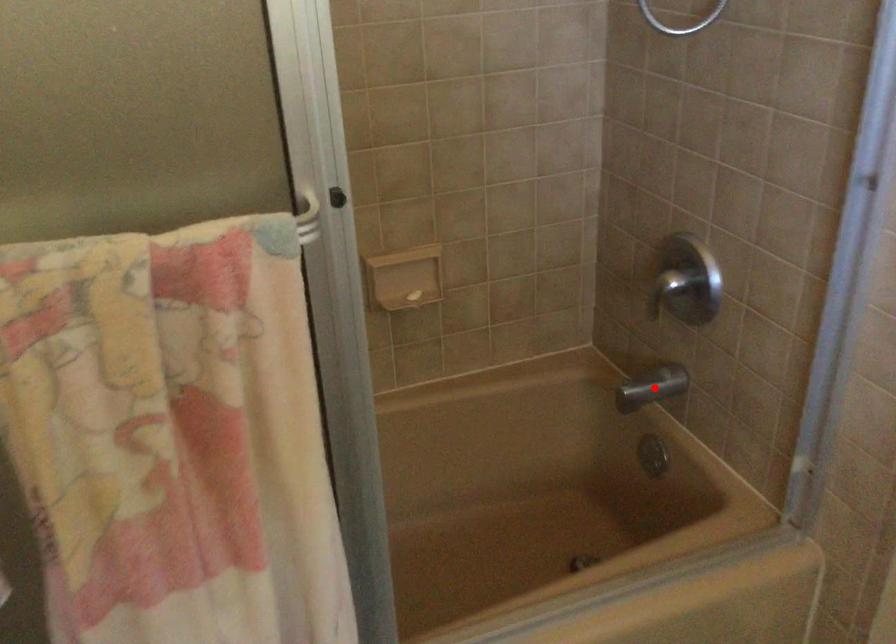
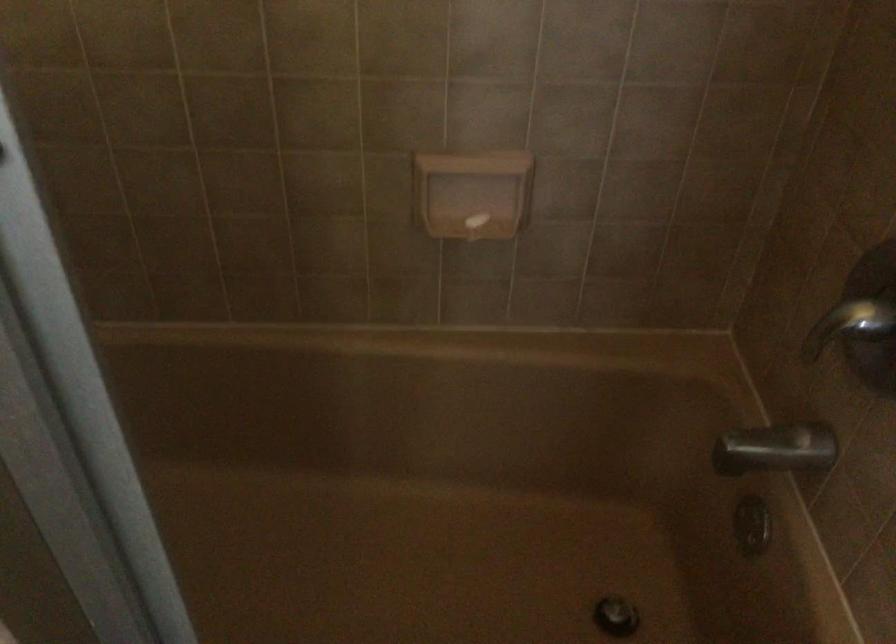
Question: I am providing you with two images of the same scene from different viewpoints. Given a red point in image1, look at the same physical point in image2. Is it:

Choices:
 (A) Closer to the viewpoint
 (B) Farther from the viewpoint

Answer: (A)